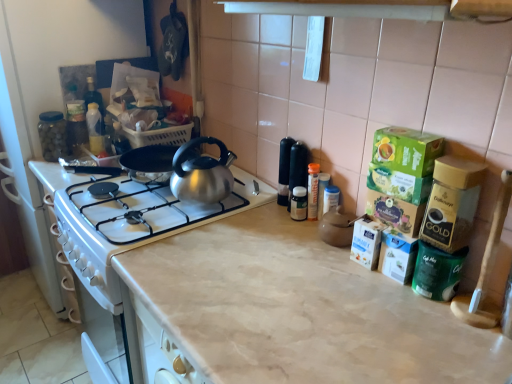
Question: From a real-world perspective, is transparent glass jar at left, the second appliance positioned from the front, physically below green matte coffee container at right, positioned as the 1th appliance in bottom-to-top order?

Choices:
 (A) yes
 (B) no

Answer: (B)

Question: Does transparent glass jar at left, the 1th appliance when ordered from back to front, have a greater width compared to green matte coffee container at right, which is the first appliance in right-to-left order?

Choices:
 (A) no
 (B) yes

Answer: (A)

Question: Is the position of transparent glass jar at left, the second appliance positioned from the front, more distant than that of green matte coffee container at right, which ranks as the 2th appliance in left-to-right order?

Choices:
 (A) no
 (B) yes

Answer: (B)

Question: From the image's perspective, does transparent glass jar at left, placed as the first appliance when sorted from left to right, appear higher than green matte coffee container at right, which is counted as the 1th appliance, starting from the front?

Choices:
 (A) yes
 (B) no

Answer: (A)

Question: Does transparent glass jar at left, the second appliance positioned from the front, have a larger size compared to green matte coffee container at right, the 2th appliance positioned from the top?

Choices:
 (A) yes
 (B) no

Answer: (A)

Question: From the image's perspective, is beige marble countertop at center positioned above or below transparent glass jar at left, which ranks as the 2th appliance in right-to-left order?

Choices:
 (A) below
 (B) above

Answer: (A)

Question: Is beige marble countertop at center to the left or to the right of transparent glass jar at left, the 1th appliance when ordered from back to front, in the image?

Choices:
 (A) right
 (B) left

Answer: (A)

Question: From a real-world perspective, is beige marble countertop at center physically located above or below transparent glass jar at left, positioned as the first appliance in top-to-bottom order?

Choices:
 (A) above
 (B) below

Answer: (B)

Question: Considering their positions, is beige marble countertop at center located in front of or behind transparent glass jar at left, positioned as the first appliance in top-to-bottom order?

Choices:
 (A) behind
 (B) front

Answer: (B)

Question: From their relative heights in the image, would you say transparent glass jar at left, positioned as the 2th appliance in bottom-to-top order, is taller or shorter than green matte coffee container at right, the 2th appliance positioned from the top?

Choices:
 (A) tall
 (B) short

Answer: (A)

Question: Is transparent glass jar at left, positioned as the 2th appliance in bottom-to-top order, inside the boundaries of green matte coffee container at right, which is the first appliance in right-to-left order, or outside?

Choices:
 (A) inside
 (B) outside

Answer: (B)

Question: Would you say transparent glass jar at left, the second appliance positioned from the front, is to the left or to the right of green matte coffee container at right, the 2th appliance positioned from the top, in the picture?

Choices:
 (A) left
 (B) right

Answer: (A)

Question: Is point (39, 117) positioned closer to the camera than point (454, 268)?

Choices:
 (A) farther
 (B) closer

Answer: (A)

Question: Is transparent glass jar at left, placed as the first appliance when sorted from left to right, in front of or behind beige marble countertop at center in the image?

Choices:
 (A) behind
 (B) front

Answer: (A)

Question: From a real-world perspective, is transparent glass jar at left, the second appliance positioned from the front, positioned above or below beige marble countertop at center?

Choices:
 (A) below
 (B) above

Answer: (B)